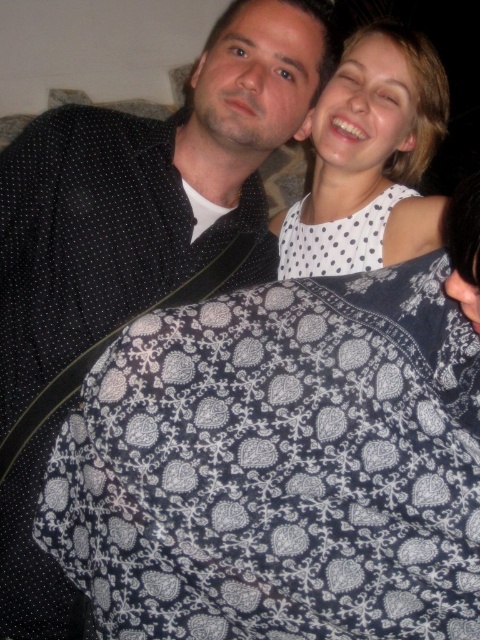
Question: Which of these objects is positioned farthest from the dark blue fabric at center?

Choices:
 (A) white dotted dress at upper right
 (B) black dotted shirt at upper left

Answer: (A)

Question: Can you confirm if dark blue fabric at center is positioned below black dotted shirt at upper left?

Choices:
 (A) no
 (B) yes

Answer: (B)

Question: Can you confirm if dark blue fabric at center is thinner than white dotted dress at upper right?

Choices:
 (A) no
 (B) yes

Answer: (A)

Question: Estimate the real-world distances between objects in this image. Which object is farther from the black dotted shirt at upper left?

Choices:
 (A) dark blue fabric at center
 (B) white dotted dress at upper right

Answer: (A)

Question: Is dark blue fabric at center smaller than white dotted dress at upper right?

Choices:
 (A) yes
 (B) no

Answer: (B)

Question: Which point is farther from the camera taking this photo?

Choices:
 (A) (404, 218)
 (B) (204, 163)
 (C) (223, 534)

Answer: (A)